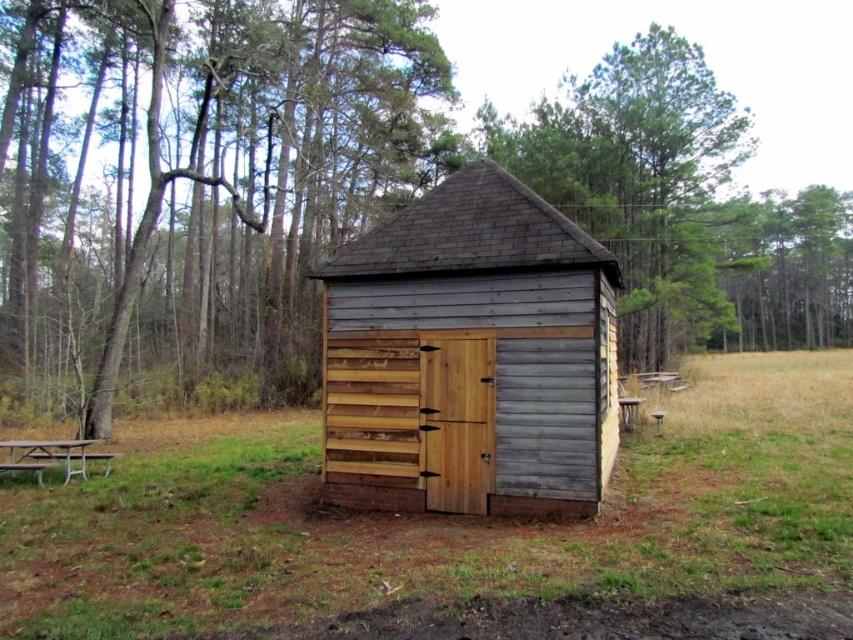
Question: Is brown wood tree at center thinner than green grass at center?

Choices:
 (A) no
 (B) yes

Answer: (A)

Question: From the image, what is the correct spatial relationship of brown wood tree at center in relation to green grass at center?

Choices:
 (A) right
 (B) left

Answer: (A)

Question: Estimate the real-world distances between objects in this image. Which object is closer to the brown wood tree at center?

Choices:
 (A) metallic silver picnic table at lower left
 (B) green grass at center

Answer: (B)

Question: Which object is farther from the camera taking this photo?

Choices:
 (A) brown wood tree at center
 (B) metallic silver picnic table at lower left
 (C) weathered wood shed at center

Answer: (B)

Question: Considering the relative positions of green grass at center and weathered wood shed at center in the image provided, where is green grass at center located with respect to weathered wood shed at center?

Choices:
 (A) left
 (B) right

Answer: (B)

Question: Among these points, which one is farthest from the camera?

Choices:
 (A) (146, 257)
 (B) (808, 404)
 (C) (347, 496)
 (D) (91, 460)

Answer: (A)